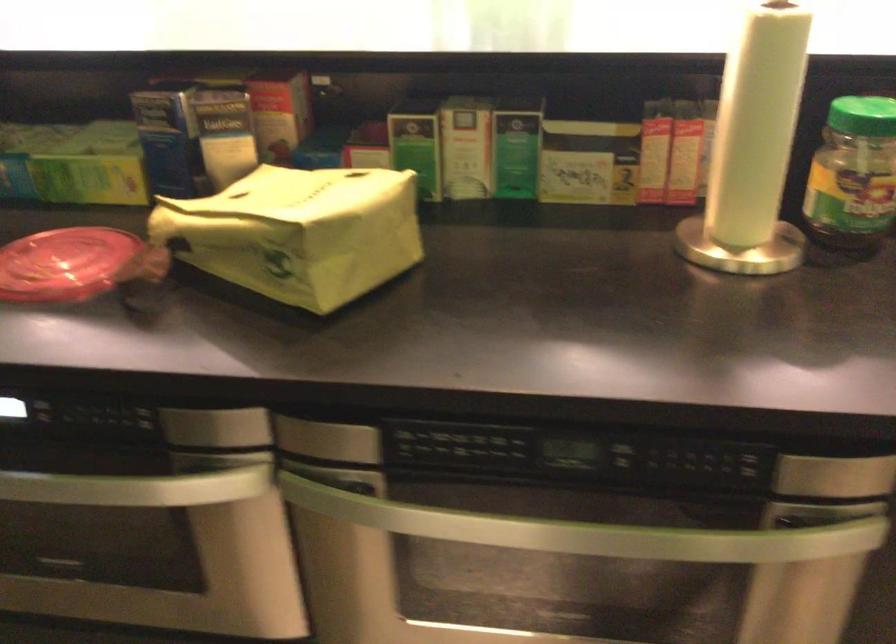
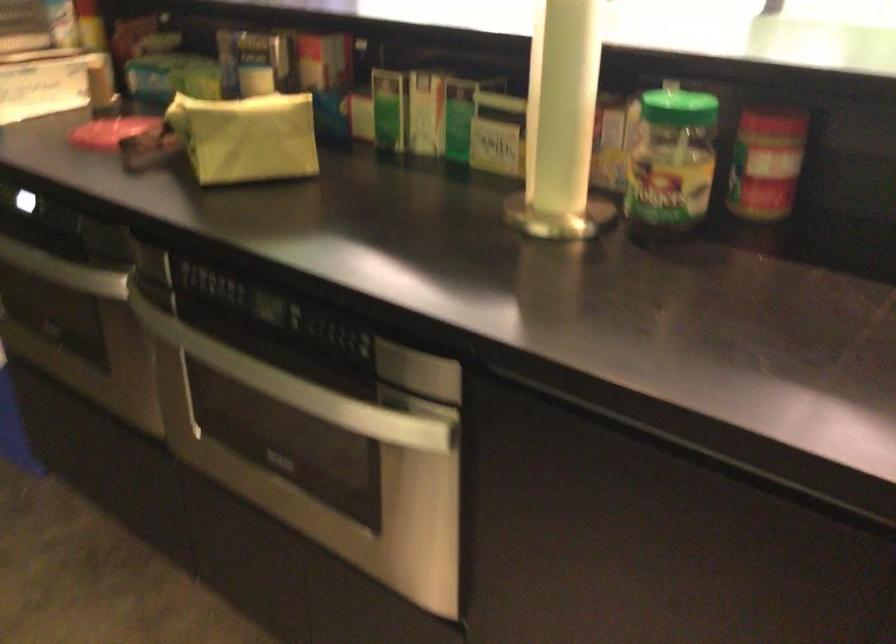
In the second image, find the point that corresponds to point (362, 241) in the first image.

(246, 137)